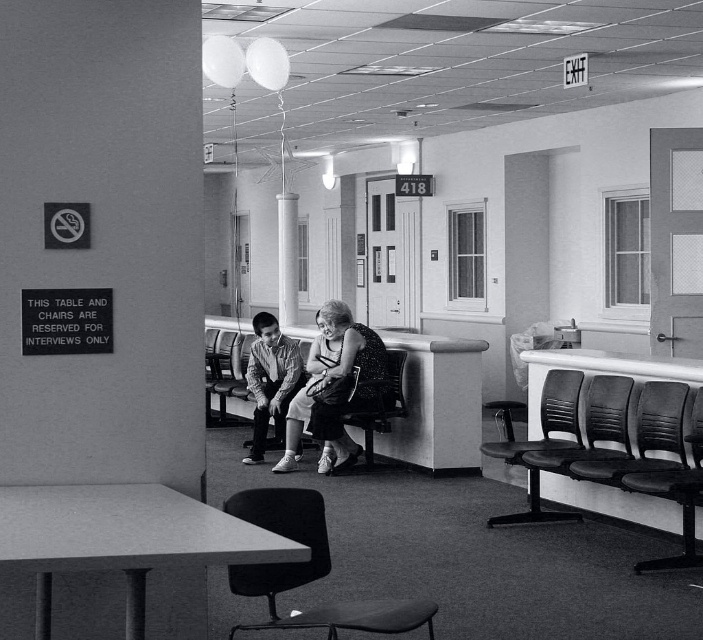
Who is more forward, (368, 365) or (225, 365)?

Point (368, 365)

Can you confirm if matte black dress at center is wider than metallic gray chair at center?

Yes, matte black dress at center is wider than metallic gray chair at center.

Find the location of a particular element. This screenshot has height=640, width=703. matte black dress at center is located at coordinates (333, 387).

Find the location of a particular element. This screenshot has width=703, height=640. matte black dress at center is located at coordinates (333, 387).

Is smooth black chair at lower center shorter than black leather chair at lower right?

Indeed, smooth black chair at lower center has a lesser height compared to black leather chair at lower right.

Based on the photo, is smooth black chair at lower center above black leather chair at lower right?

No, smooth black chair at lower center is not above black leather chair at lower right.

What do you see at coordinates (309, 570) in the screenshot? This screenshot has width=703, height=640. I see `smooth black chair at lower center` at bounding box center [309, 570].

Where is `smooth black chair at lower center`? The height and width of the screenshot is (640, 703). smooth black chair at lower center is located at coordinates (309, 570).

Is the position of black plastic chair at lower right less distant than that of black leather chair at lower right?

No.

Is point (576, 385) behind point (669, 561)?

Yes, it is behind point (669, 561).

The width and height of the screenshot is (703, 640). I want to click on black plastic chair at lower right, so 548,419.